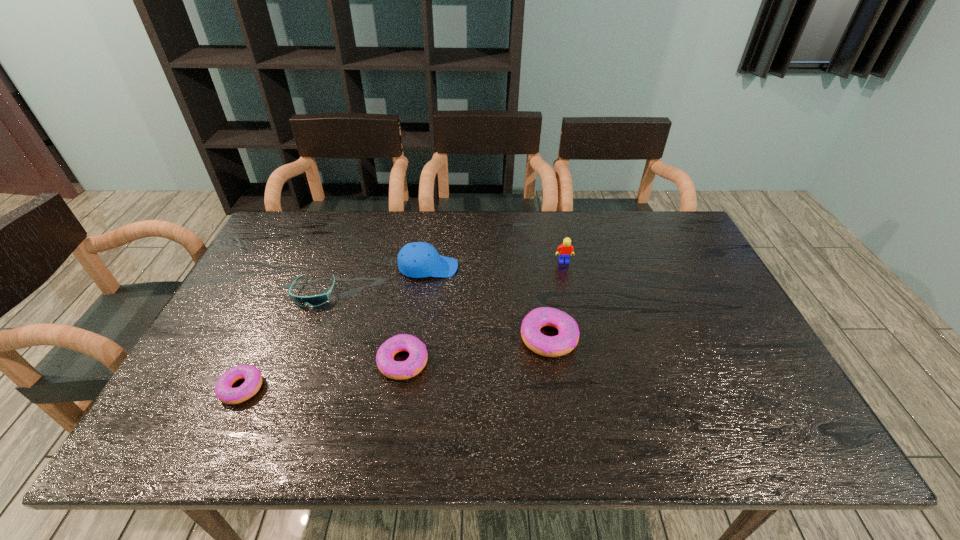
You are a GUI agent. You are given a task and a screenshot of the screen. Output one action in this format:
    pyautogui.click(x=<x>, y=<y>)
    Task: Click on the free space at the far left corner of the desktop
    
    Given the screenshot: What is the action you would take?
    pyautogui.click(x=284, y=242)

Where is `blank space at the far right corner of the desktop`? Image resolution: width=960 pixels, height=540 pixels. blank space at the far right corner of the desktop is located at coordinates (667, 227).

Where is `vacant point located between the third tallest object and the Lego`? vacant point located between the third tallest object and the Lego is located at coordinates (557, 300).

The image size is (960, 540). I want to click on free space between the sunglasses and the cap, so click(372, 280).

The height and width of the screenshot is (540, 960). Identify the location of free space between the second tallest doughnut and the shortest doughnut. (323, 375).

Locate an element on the screen. The width and height of the screenshot is (960, 540). blank region between the sunglasses and the leftmost doughnut is located at coordinates (277, 341).

This screenshot has width=960, height=540. I want to click on free space between the third tallest object and the Lego, so click(x=557, y=300).

Where is `vacant area between the Lego and the tallest doughnut`? This screenshot has width=960, height=540. vacant area between the Lego and the tallest doughnut is located at coordinates (557, 300).

The image size is (960, 540). I want to click on empty space that is in between the second shortest doughnut and the Lego, so click(484, 312).

Locate an element on the screen. free area in between the Lego and the cap is located at coordinates (496, 265).